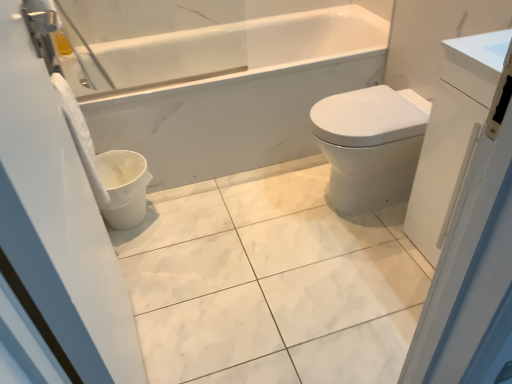
The width and height of the screenshot is (512, 384). Find the location of `free spot above white marble tile at center (from a real-world perspective)`. free spot above white marble tile at center (from a real-world perspective) is located at coordinates (271, 276).